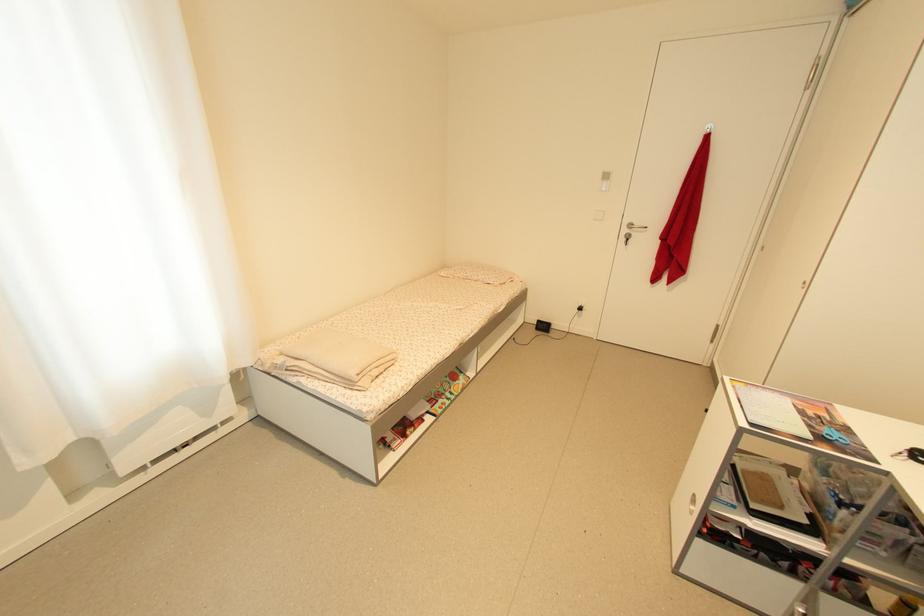
Identify the location of metal door handle. Image resolution: width=924 pixels, height=616 pixels. (636, 227).